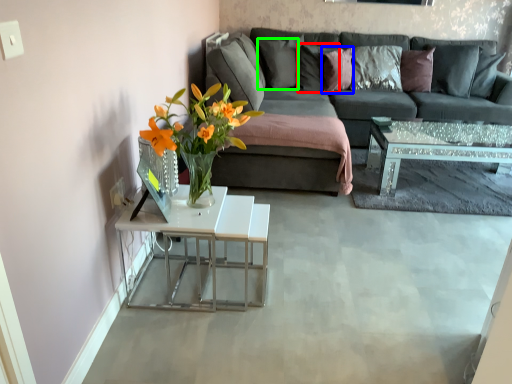
Question: Which is nearer to the pillow (highlighted by a red box)? pillow (highlighted by a blue box) or pillow (highlighted by a green box).

Choices:
 (A) pillow
 (B) pillow

Answer: (A)